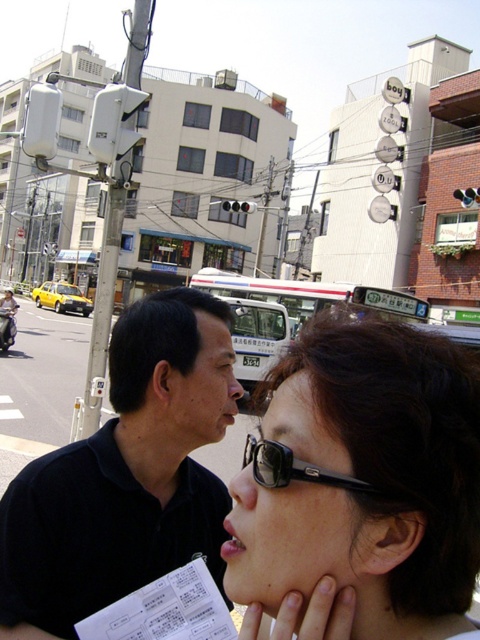
You are a fashion designer analyzing the urban scene. You notice the black matte shirt at center and the black plastic sunglasses at upper center. Which object is wider in terms of their visual representation in the image?

The black matte shirt at center is wider than the black plastic sunglasses at upper center according to the description provided.

You are a photographer standing in the middle of the street. You want to take a photo of both the yellow taxi and the white bus with red and blue stripes. However, you notice two points in the image at coordinates point (157,323) and point (371,490). Which point is closer to your camera lens?

Point (157,323) is further to the camera than point (371,490), so the point closer to the camera lens is point (371,490).